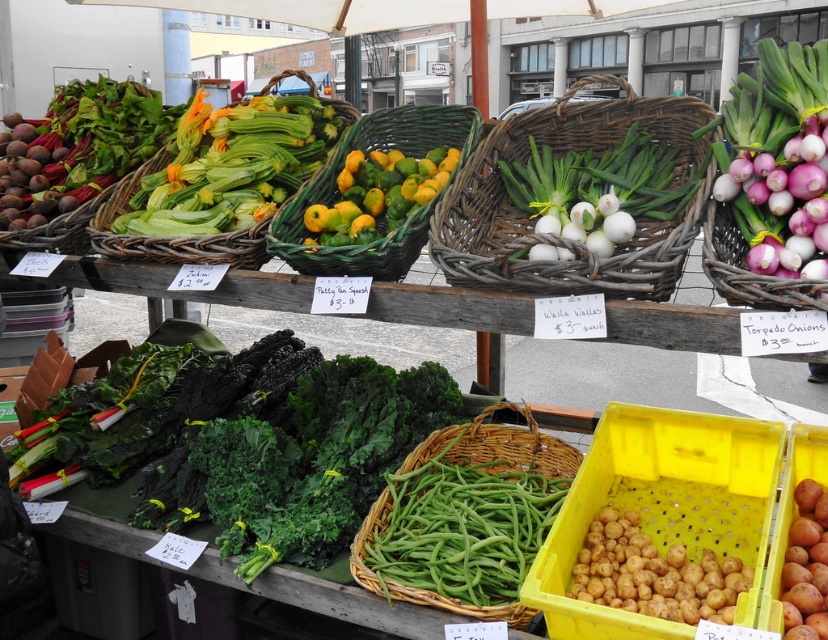
Question: Estimate the real-world distances between objects in this image. Which object is farther from the lime-green glossy citrus at center?

Choices:
 (A) green wicker basket at upper center
 (B) white wicker basket at center

Answer: (A)

Question: Which object is the farthest from the yellow matte potatoes at lower right?

Choices:
 (A) white wicker basket at center
 (B) bright green leafy vegetables at left
 (C) green woven basket at center
 (D) lime-green glossy citrus at center

Answer: (B)

Question: Is white wicker basket at center below yellow matte potatoes at lower right?

Choices:
 (A) yes
 (B) no

Answer: (B)

Question: Which of the following is the farthest from the observer?

Choices:
 (A) (465, 449)
 (B) (331, 221)

Answer: (A)

Question: Can you confirm if white wicker basket at center is bigger than green wicker basket at upper center?

Choices:
 (A) yes
 (B) no

Answer: (A)

Question: Does green woven basket at center appear under lime-green glossy citrus at center?

Choices:
 (A) no
 (B) yes

Answer: (A)